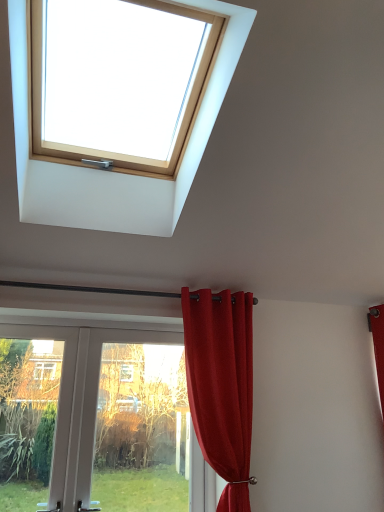
Question: Should I look upward or downward to see white plastic door at lower left?

Choices:
 (A) down
 (B) up

Answer: (A)

Question: Is transparent glass door at lower left a part of satin red curtain at upper center?

Choices:
 (A) no
 (B) yes

Answer: (A)

Question: Can you confirm if satin red curtain at upper center is wider than transparent glass door at lower left?

Choices:
 (A) yes
 (B) no

Answer: (A)

Question: Does satin red curtain at upper center come in front of transparent glass door at lower left?

Choices:
 (A) no
 (B) yes

Answer: (B)

Question: Does satin red curtain at upper center have a lesser height compared to transparent glass door at lower left?

Choices:
 (A) no
 (B) yes

Answer: (A)

Question: From a real-world perspective, is satin red curtain at upper center beneath transparent glass door at lower left?

Choices:
 (A) yes
 (B) no

Answer: (B)

Question: Does satin red curtain at upper center have a larger size compared to transparent glass door at lower left?

Choices:
 (A) yes
 (B) no

Answer: (A)

Question: Does satin red curtain at upper center have a greater height compared to wooden skylight at upper center?

Choices:
 (A) no
 (B) yes

Answer: (B)

Question: Is satin red curtain at upper center surrounding wooden skylight at upper center?

Choices:
 (A) yes
 (B) no

Answer: (B)

Question: Is satin red curtain at upper center thinner than wooden skylight at upper center?

Choices:
 (A) no
 (B) yes

Answer: (B)

Question: From the image's perspective, is satin red curtain at upper center under wooden skylight at upper center?

Choices:
 (A) no
 (B) yes

Answer: (B)

Question: Considering the relative sizes of satin red curtain at upper center and wooden skylight at upper center in the image provided, is satin red curtain at upper center smaller than wooden skylight at upper center?

Choices:
 (A) no
 (B) yes

Answer: (B)

Question: Is the position of satin red curtain at upper center more distant than that of wooden skylight at upper center?

Choices:
 (A) yes
 (B) no

Answer: (A)

Question: Could white plastic door at lower left be considered to be inside wooden skylight at upper center?

Choices:
 (A) yes
 (B) no

Answer: (B)